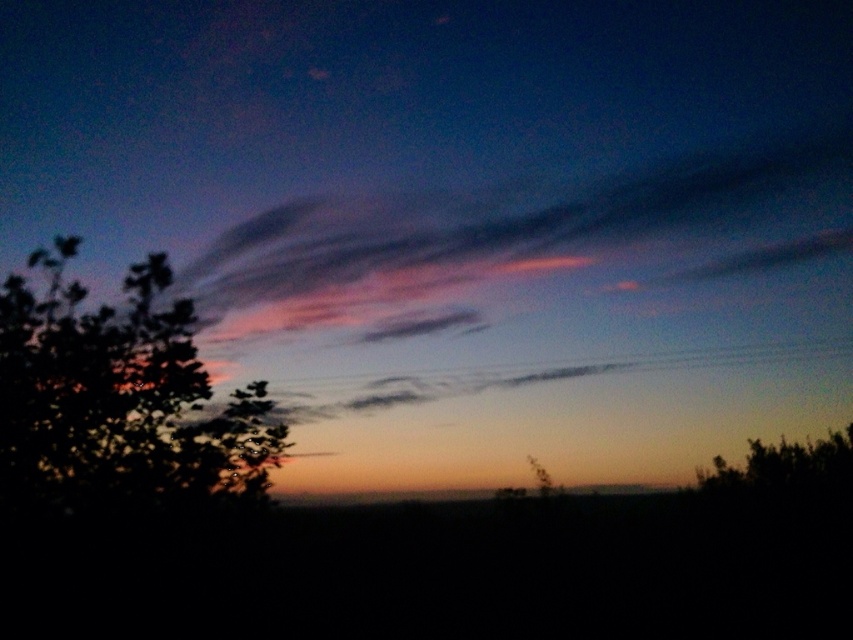
You are standing in the twilight scene and want to take a photo of the pink translucent clouds at upper center and the green leafy tree at left. If your camera can focus on objects within 5 meters, will both be in focus?

The distance between the pink translucent clouds at upper center and the green leafy tree at left is 6.02 meters. Since the camera can only focus within 5 meters, the two objects are more than 5 meters apart, so they cannot both be in focus simultaneously.

You are standing in the twilight scene and want to take a photo of both point (144, 472) and point (424, 499). Which point should you focus on first to ensure both are in clear view?

You should focus on point (144, 472) first because it is closer to the camera than point (424, 499), ensuring both are in focus when using a shallow depth of field.